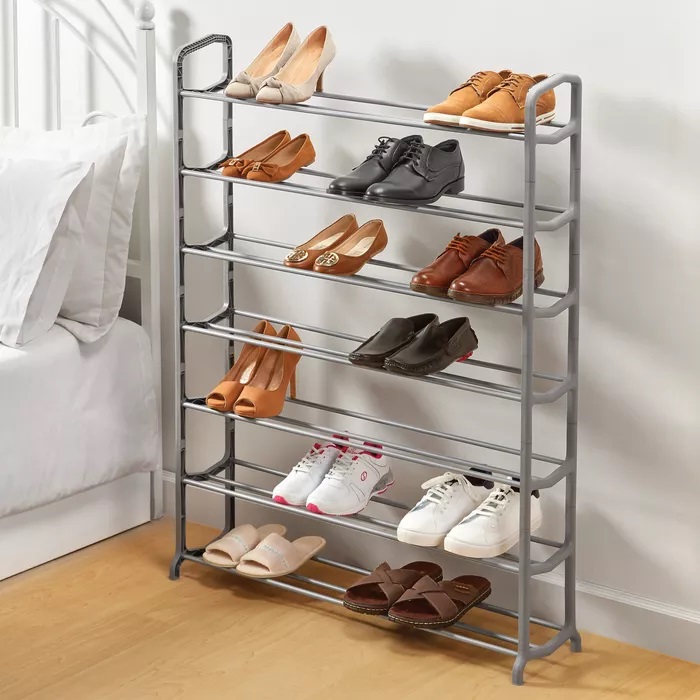
The image size is (700, 700). I want to click on shoe on second shelf down, so click(x=242, y=158), click(x=267, y=172), click(x=363, y=173), click(x=407, y=188).